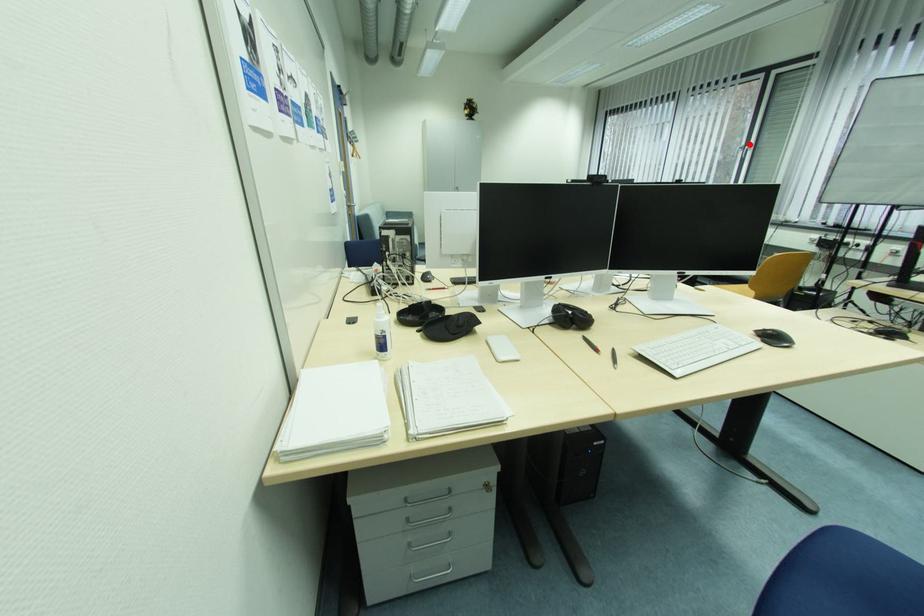
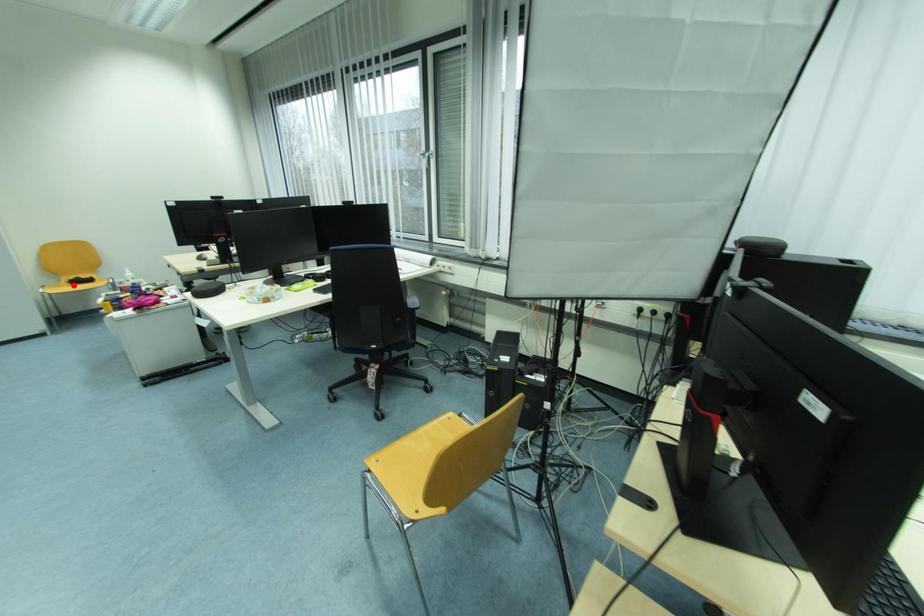
I am providing you with two images of the same scene from different viewpoints. A red point is marked on the first image and another point is marked on the second image. Is the red point in image1 aligned with the point shown in image2?

No